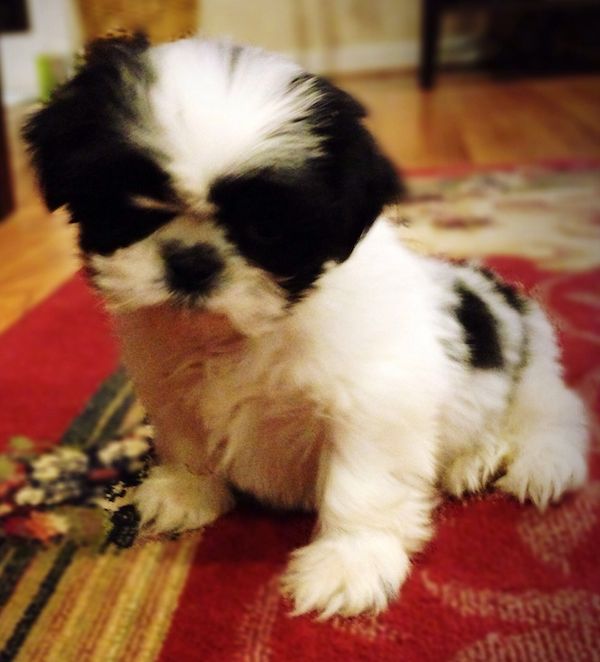
Where is `red carpet`? red carpet is located at coordinates (261, 612).